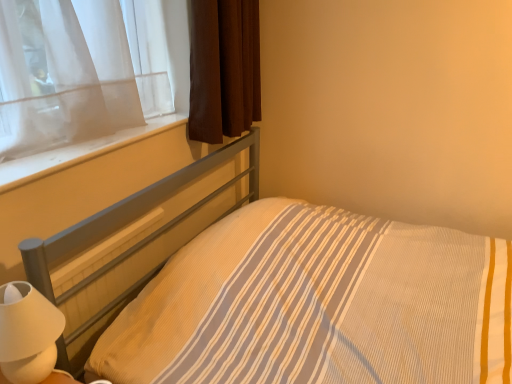
Question: From the image's perspective, does white smooth window sill at upper left appear lower than brown fabric curtain at upper left?

Choices:
 (A) yes
 (B) no

Answer: (A)

Question: Does white smooth window sill at upper left lie in front of brown fabric curtain at upper left?

Choices:
 (A) yes
 (B) no

Answer: (A)

Question: Considering the relative sizes of white smooth window sill at upper left and brown fabric curtain at upper left in the image provided, is white smooth window sill at upper left taller than brown fabric curtain at upper left?

Choices:
 (A) no
 (B) yes

Answer: (A)

Question: From a real-world perspective, does white smooth window sill at upper left sit lower than brown fabric curtain at upper left?

Choices:
 (A) yes
 (B) no

Answer: (A)

Question: Does white smooth window sill at upper left appear on the left side of brown fabric curtain at upper left?

Choices:
 (A) no
 (B) yes

Answer: (B)

Question: Looking at their shapes, would you say white matte table lamp at lower left is wider or thinner than brown fabric curtain at upper left?

Choices:
 (A) thin
 (B) wide

Answer: (A)

Question: From a real-world perspective, is white matte table lamp at lower left physically located above or below brown fabric curtain at upper left?

Choices:
 (A) below
 (B) above

Answer: (A)

Question: Would you say white matte table lamp at lower left is inside or outside brown fabric curtain at upper left?

Choices:
 (A) outside
 (B) inside

Answer: (A)

Question: Is white matte table lamp at lower left taller or shorter than brown fabric curtain at upper left?

Choices:
 (A) short
 (B) tall

Answer: (A)

Question: Considering their positions, is white smooth window sill at upper left located in front of or behind brown fabric curtain at upper left?

Choices:
 (A) front
 (B) behind

Answer: (A)

Question: In terms of width, does white smooth window sill at upper left look wider or thinner when compared to brown fabric curtain at upper left?

Choices:
 (A) wide
 (B) thin

Answer: (A)

Question: From a real-world perspective, is white smooth window sill at upper left above or below brown fabric curtain at upper left?

Choices:
 (A) below
 (B) above

Answer: (A)

Question: Do you think white smooth window sill at upper left is within brown fabric curtain at upper left, or outside of it?

Choices:
 (A) inside
 (B) outside

Answer: (B)

Question: Based on their positions, is yellow striped fabric at center located to the left or right of white smooth window sill at upper left?

Choices:
 (A) left
 (B) right

Answer: (B)

Question: Considering their positions, is yellow striped fabric at center located in front of or behind white smooth window sill at upper left?

Choices:
 (A) behind
 (B) front

Answer: (B)